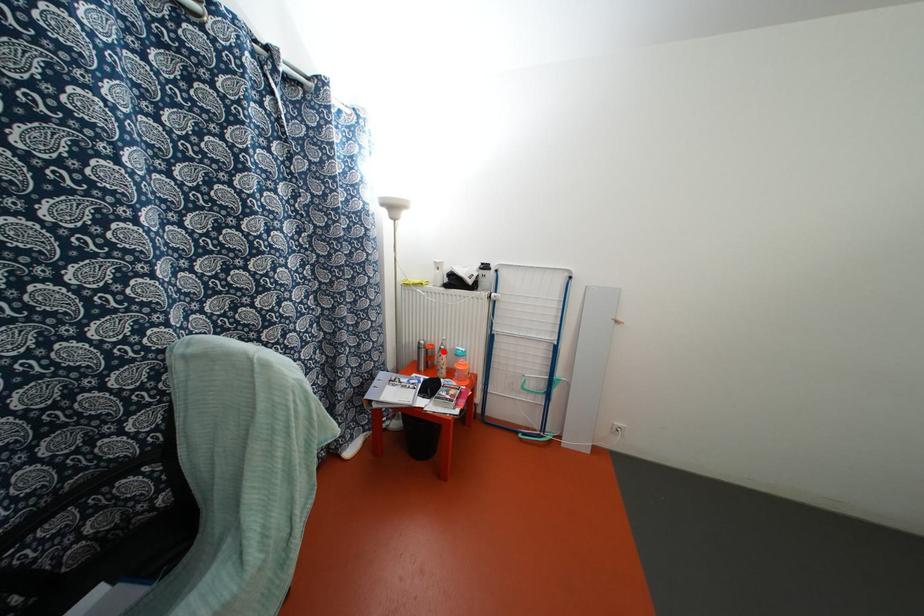
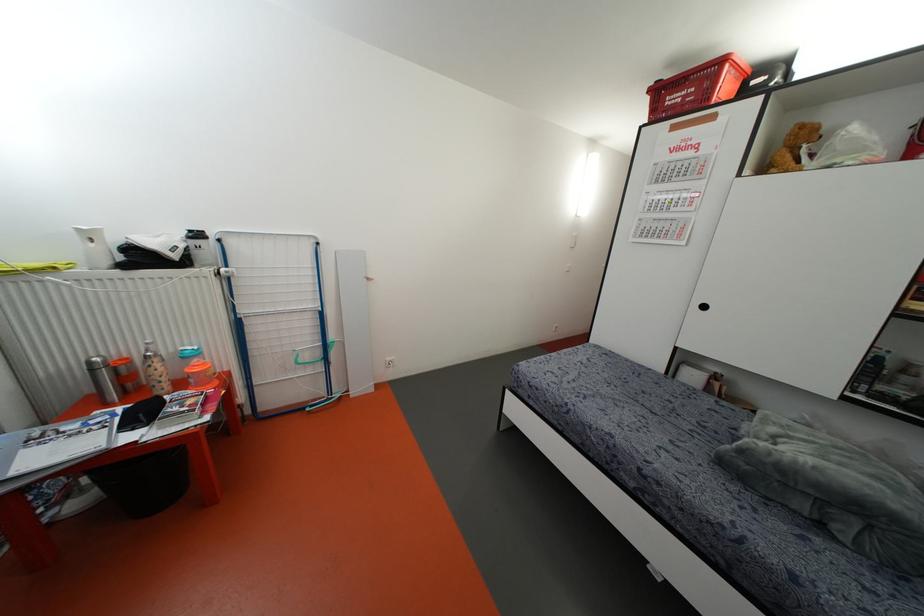
The point at the highlighted location is marked in the first image. Where is the corresponding point in the second image?

(155, 360)